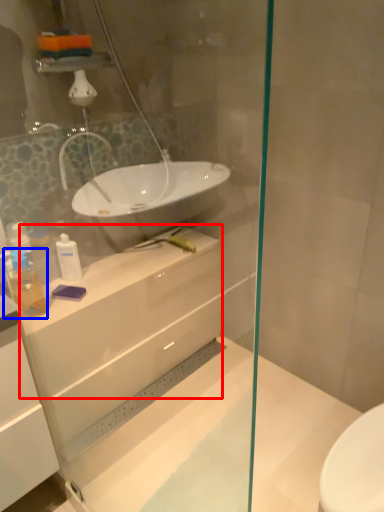
Question: Which of the following is the farthest to the observer, counter top (highlighted by a red box) or toiletry (highlighted by a blue box)?

Choices:
 (A) counter top
 (B) toiletry

Answer: (A)